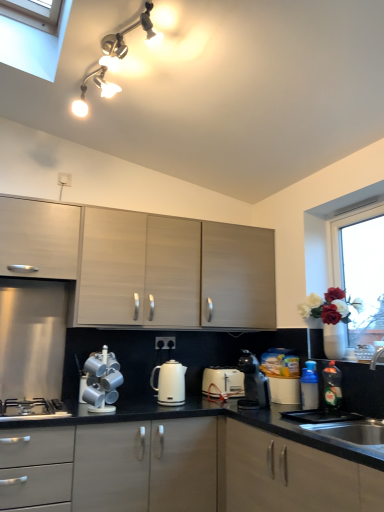
You are a GUI agent. You are given a task and a screenshot of the screen. Output one action in this format:
    pyautogui.click(x=<x>, y=<y>)
    Task: Click on the white plastic electric outlet at upper center, the 1th electric outlet positioned from the top
    The image size is (384, 512).
    Given the screenshot: What is the action you would take?
    pyautogui.click(x=64, y=179)

Where is `matte wood cabinets at center, arranged as the second cabinetry when viewed from the top`? This screenshot has height=512, width=384. matte wood cabinets at center, arranged as the second cabinetry when viewed from the top is located at coordinates (145, 265).

Locate an element on the screen. blue plastic bottle at lower right, the 2th bottle from the right is located at coordinates (309, 386).

The height and width of the screenshot is (512, 384). Describe the element at coordinates (309, 386) in the screenshot. I see `blue plastic bottle at lower right, the 2th bottle from the right` at that location.

This screenshot has height=512, width=384. What do you see at coordinates (375, 358) in the screenshot?
I see `white glossy vase at right` at bounding box center [375, 358].

This screenshot has height=512, width=384. In order to click on white plastic electric outlet at upper center, the 1th electric outlet positioned from the top in this screenshot , I will do `click(64, 179)`.

Who is shorter, black plastic coffee maker at center, the 1th kitchen appliance in the right-to-left sequence, or white plastic toaster at center, the first appliance in the right-to-left sequence?

white plastic toaster at center, the first appliance in the right-to-left sequence.

I want to click on kitchen appliance that is the 2nd one when counting forward from the white plastic toaster at center, which appears as the 1th appliance when viewed from the back, so pyautogui.click(x=254, y=381).

From the image's perspective, between black plastic coffee maker at center, the 1th kitchen appliance in the right-to-left sequence, and white plastic toaster at center, the first appliance in the right-to-left sequence, which one is located above?

From the image's view, black plastic coffee maker at center, the 1th kitchen appliance in the right-to-left sequence, is above.

What's the angular difference between black plastic coffee maker at center, the 1th kitchen appliance in the right-to-left sequence, and white plastic toaster at center, which appears as the 1th appliance when viewed from the back,'s facing directions?

The angular difference between black plastic coffee maker at center, the 1th kitchen appliance in the right-to-left sequence, and white plastic toaster at center, which appears as the 1th appliance when viewed from the back, is 85.8 degrees.

Consider the image. Between matte gray cabinets at center, which is counted as the third cabinetry, starting from the top, and white plastic electric outlet at upper center, the 1th electric outlet positioned from the top, which one has larger size?

Bigger between the two is matte gray cabinets at center, which is counted as the third cabinetry, starting from the top.

Between matte gray cabinets at center, which is counted as the third cabinetry, starting from the top, and white plastic electric outlet at upper center, the 1th electric outlet positioned from the top, which one appears on the left side from the viewer's perspective?

From the viewer's perspective, white plastic electric outlet at upper center, the 1th electric outlet positioned from the top, appears more on the left side.

Is matte gray cabinets at center, which ranks as the first cabinetry in bottom-to-top order, turned away from white plastic electric outlet at upper center, marked as the 2th electric outlet in a bottom-to-top arrangement?

No, matte gray cabinets at center, which ranks as the first cabinetry in bottom-to-top order, is not facing away from white plastic electric outlet at upper center, marked as the 2th electric outlet in a bottom-to-top arrangement.

Which is behind, point (254, 377) or point (43, 411)?

The point (254, 377) is more distant.

Considering the sizes of objects black plastic coffee maker at center, which is the 2th kitchen appliance from left to right, and black matte gas stove at lower left in the image provided, who is wider, black plastic coffee maker at center, which is the 2th kitchen appliance from left to right, or black matte gas stove at lower left?

Wider between the two is black matte gas stove at lower left.

From the image's perspective, which object appears higher, black plastic coffee maker at center, the 1th kitchen appliance in the right-to-left sequence, or black matte gas stove at lower left?

black plastic coffee maker at center, the 1th kitchen appliance in the right-to-left sequence, appears higher in the image.

Is the position of green glossy bottle at lower right, acting as the first bottle starting from the right, more distant than that of blue plastic bottle at lower right, placed as the 1th bottle when sorted from left to right?

No, green glossy bottle at lower right, acting as the first bottle starting from the right, is in front of blue plastic bottle at lower right, placed as the 1th bottle when sorted from left to right.

This screenshot has height=512, width=384. I want to click on bottle that is above the blue plastic bottle at lower right, the 2th bottle from the right (from the image's perspective), so click(x=332, y=385).

Considering the sizes of green glossy bottle at lower right, the second bottle in the left-to-right sequence, and blue plastic bottle at lower right, placed as the 1th bottle when sorted from left to right, in the image, is green glossy bottle at lower right, the second bottle in the left-to-right sequence, taller or shorter than blue plastic bottle at lower right, placed as the 1th bottle when sorted from left to right,?

Considering their sizes, green glossy bottle at lower right, the second bottle in the left-to-right sequence, has more height than blue plastic bottle at lower right, placed as the 1th bottle when sorted from left to right.

Is white glossy electric kettle at center, which is the 1th kitchen appliance in left-to-right order, a part of matte gray cabinets at center, which is counted as the third cabinetry, starting from the top?

No, white glossy electric kettle at center, which is the 1th kitchen appliance in left-to-right order, is not surrounded by matte gray cabinets at center, which is counted as the third cabinetry, starting from the top.

From the image's perspective, which object appears higher, matte gray cabinets at center, which is counted as the third cabinetry, starting from the top, or white glossy electric kettle at center, which is the 1th kitchen appliance in left-to-right order?

white glossy electric kettle at center, which is the 1th kitchen appliance in left-to-right order, appears higher in the image.

Between matte gray cabinets at center, which ranks as the first cabinetry in bottom-to-top order, and white glossy electric kettle at center, arranged as the 2th kitchen appliance when viewed from the right, which one has more height?

With more height is matte gray cabinets at center, which ranks as the first cabinetry in bottom-to-top order.

Is matte gray cabinets at center, which is counted as the third cabinetry, starting from the top, smaller than white glossy electric kettle at center, which is the 1th kitchen appliance in left-to-right order?

Incorrect, matte gray cabinets at center, which is counted as the third cabinetry, starting from the top, is not smaller in size than white glossy electric kettle at center, which is the 1th kitchen appliance in left-to-right order.

From their relative heights in the image, would you say green glossy bottle at lower right, acting as the first bottle starting from the right, is taller or shorter than black matte gas stove at lower left?

green glossy bottle at lower right, acting as the first bottle starting from the right, is taller than black matte gas stove at lower left.

Is black matte gas stove at lower left at the back of green glossy bottle at lower right, acting as the first bottle starting from the right?

No, black matte gas stove at lower left is not at the back of green glossy bottle at lower right, acting as the first bottle starting from the right.

Considering the relative sizes of green glossy bottle at lower right, acting as the first bottle starting from the right, and black matte gas stove at lower left in the image provided, is green glossy bottle at lower right, acting as the first bottle starting from the right, bigger than black matte gas stove at lower left?

Incorrect, green glossy bottle at lower right, acting as the first bottle starting from the right, is not larger than black matte gas stove at lower left.

Is point (331, 401) closer or farther from the camera than point (19, 400)?

Point (331, 401) appears to be farther away from the viewer than point (19, 400).

Can you confirm if silver metallic mugs at lower center, which ranks as the first appliance in front-to-back order, is taller than white glossy electric kettle at center, arranged as the 2th kitchen appliance when viewed from the right?

Correct, silver metallic mugs at lower center, which ranks as the first appliance in front-to-back order, is much taller as white glossy electric kettle at center, arranged as the 2th kitchen appliance when viewed from the right.

Where is `appliance on the left side of white glossy electric kettle at center, arranged as the 2th kitchen appliance when viewed from the right`? The height and width of the screenshot is (512, 384). appliance on the left side of white glossy electric kettle at center, arranged as the 2th kitchen appliance when viewed from the right is located at coordinates (102, 382).

From a real-world perspective, who is located higher, silver metallic mugs at lower center, the 1th appliance positioned from the left, or white glossy electric kettle at center, which is the 1th kitchen appliance in left-to-right order?

silver metallic mugs at lower center, the 1th appliance positioned from the left, is physically above.

In the scene shown: Are silver metallic mugs at lower center, which ranks as the first appliance in front-to-back order, and white glossy electric kettle at center, arranged as the 2th kitchen appliance when viewed from the right, far apart?

No, there isn't a large distance between silver metallic mugs at lower center, which ranks as the first appliance in front-to-back order, and white glossy electric kettle at center, arranged as the 2th kitchen appliance when viewed from the right.

This screenshot has height=512, width=384. Find the location of `the 2nd kitchen appliance in front when counting from the white plastic toaster at center, the first appliance in the right-to-left sequence`. the 2nd kitchen appliance in front when counting from the white plastic toaster at center, the first appliance in the right-to-left sequence is located at coordinates (254, 381).

At what (x,y) coordinates should I click in order to perform the action: click on the 3rd cabinetry positioned below the white plastic electric outlet at upper center, which is the second electric outlet from back to front (from the image's perspective). Please return your answer as a coordinate pair (x, y). The width and height of the screenshot is (384, 512). Looking at the image, I should click on (178, 469).

Estimate the real-world distances between objects in this image. Which object is further from matte wood cabinets at center, the second cabinetry from the bottom, white plastic electric outlet at center, marked as the second electric outlet in a top-to-bottom arrangement, or blue plastic bottle at lower right, the 2th bottle from the right?

Based on the image, blue plastic bottle at lower right, the 2th bottle from the right, appears to be further to matte wood cabinets at center, the second cabinetry from the bottom.

Estimate the real-world distances between objects in this image. Which object is further from green glossy bottle at lower right, acting as the first bottle starting from the right, black plastic coffee maker at center, the 1th kitchen appliance in the right-to-left sequence, or silver metallic mugs at lower center, which ranks as the first appliance in front-to-back order?

silver metallic mugs at lower center, which ranks as the first appliance in front-to-back order, lies further to green glossy bottle at lower right, acting as the first bottle starting from the right, than the other object.

From the image, which object appears to be nearer to white glossy vase at right, white glossy electric kettle at center, which is the 1th kitchen appliance in left-to-right order, or white plastic electric outlet at upper center, placed as the 1th electric outlet when sorted from front to back?

Based on the image, white glossy electric kettle at center, which is the 1th kitchen appliance in left-to-right order, appears to be nearer to white glossy vase at right.

Based on their spatial positions, is blue plastic bottle at lower right, placed as the 1th bottle when sorted from left to right, or white plastic electric outlet at upper center, the 1th electric outlet in the left-to-right sequence, closer to silver metallic mugs at lower center, which is the second appliance from right to left?

blue plastic bottle at lower right, placed as the 1th bottle when sorted from left to right, is positioned closer to the anchor silver metallic mugs at lower center, which is the second appliance from right to left.

Which object lies nearer to the anchor point silver metallic mugs at lower center, which is the second appliance from right to left, black plastic coffee maker at center, which is the 2th kitchen appliance from left to right, or green glossy bottle at lower right, the second bottle in the left-to-right sequence?

Among the two, black plastic coffee maker at center, which is the 2th kitchen appliance from left to right, is located nearer to silver metallic mugs at lower center, which is the second appliance from right to left.

Estimate the real-world distances between objects in this image. Which object is closer to matte wood cabinets at center, arranged as the second cabinetry when viewed from the top, white plastic electric outlet at upper center, the 1th electric outlet positioned from the top, or white glossy electric kettle at center, arranged as the 2th kitchen appliance when viewed from the right?

white glossy electric kettle at center, arranged as the 2th kitchen appliance when viewed from the right, lies closer to matte wood cabinets at center, arranged as the second cabinetry when viewed from the top, than the other object.

Considering their positions, is white plastic electric outlet at center, arranged as the 1th electric outlet when viewed from the back, positioned closer to white glossy electric kettle at center, which is the 1th kitchen appliance in left-to-right order, than white plastic electric outlet at upper center, placed as the 1th electric outlet when sorted from front to back?

The object closer to white glossy electric kettle at center, which is the 1th kitchen appliance in left-to-right order, is white plastic electric outlet at center, arranged as the 1th electric outlet when viewed from the back.

Which object lies further to the anchor point white plastic toaster at center, the first appliance in the right-to-left sequence, black plastic coffee maker at center, which is the 2th kitchen appliance from left to right, or white plastic electric outlet at center, the 2th electric outlet positioned from the left?

The object further to white plastic toaster at center, the first appliance in the right-to-left sequence, is white plastic electric outlet at center, the 2th electric outlet positioned from the left.

The image size is (384, 512). Identify the location of bottle between white plastic electric outlet at upper center, placed as the 1th electric outlet when sorted from front to back, and green glossy bottle at lower right, acting as the first bottle starting from the right, from left to right. (309, 386).

The width and height of the screenshot is (384, 512). I want to click on appliance between matte white light fixture at upper center and black matte gas stove at lower left in the up-down direction, so click(x=102, y=382).

The height and width of the screenshot is (512, 384). I want to click on gas stove located between white plastic electric outlet at upper center, placed as the 1th electric outlet when sorted from front to back, and green glossy bottle at lower right, the second bottle in the left-to-right sequence, in the left-right direction, so click(x=32, y=410).

Where is `appliance situated between silver metallic mugs at lower center, positioned as the second appliance in back-to-front order, and blue plastic bottle at lower right, the 2th bottle from the right, from left to right`? This screenshot has height=512, width=384. appliance situated between silver metallic mugs at lower center, positioned as the second appliance in back-to-front order, and blue plastic bottle at lower right, the 2th bottle from the right, from left to right is located at coordinates (223, 382).